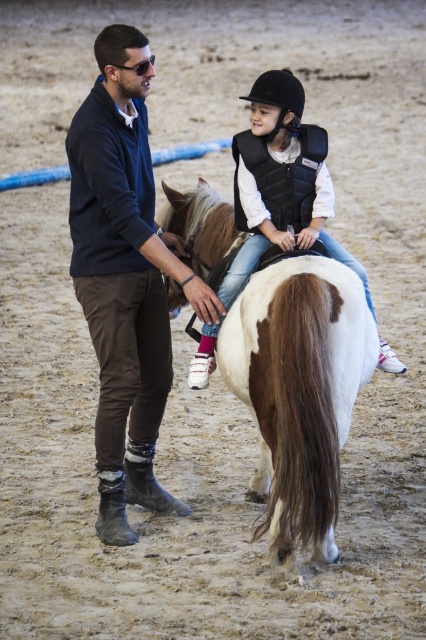
You are a photographer setting up a shoot in the equestrian arena. You need to ensure that the dark blue sweater at center and the white matte vest at center are both visible in the frame. Given their sizes, which object should you focus on first to ensure both are in focus?

The dark blue sweater at center has a larger size compared to the white matte vest at center, so focusing on the larger dark blue sweater at center first would help ensure both objects are in focus.

Based on the coordinates provided, where exactly is the white glossy horse at center located in the image?

The white glossy horse at center is located at point coordinates of [299,390].

You are a photographer positioned at the entrance of the arena. You want to take a photo of the white glossy horse at center and the white matte vest at center. Based on their positions, which object should you focus on first if you move from left to right across the arena?

The white glossy horse at center should be focused on first because it is positioned to the right of the white matte vest at center, meaning the vest is to the left of the horse. When moving from left to right, the vest would come first, but the question asks which to focus on first while moving right. Wait, there might be confusion here. Let me clarify. If the horse is to the right of the vest, then when moving left to right, the vest is encountered first. But the question asks which to focus on first when